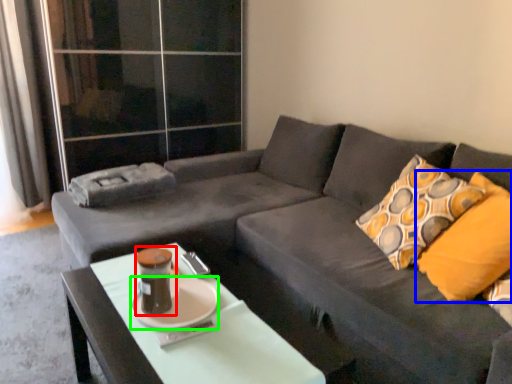
Question: Which is farther away from teal (highlighted by a red box)? throw pillow (highlighted by a blue box) or saucer (highlighted by a green box)?

Choices:
 (A) throw pillow
 (B) saucer

Answer: (A)